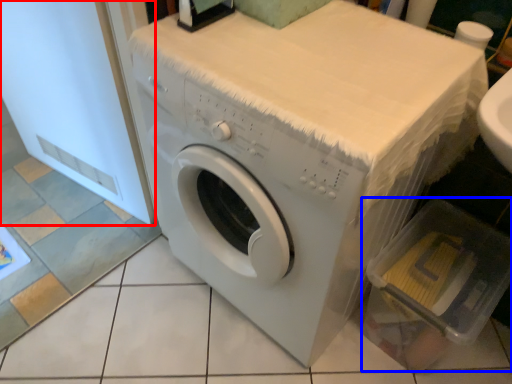
Question: Which object appears closest to the camera in this image, screen door (highlighted by a red box) or dish washer (highlighted by a blue box)?

Choices:
 (A) screen door
 (B) dish washer

Answer: (A)